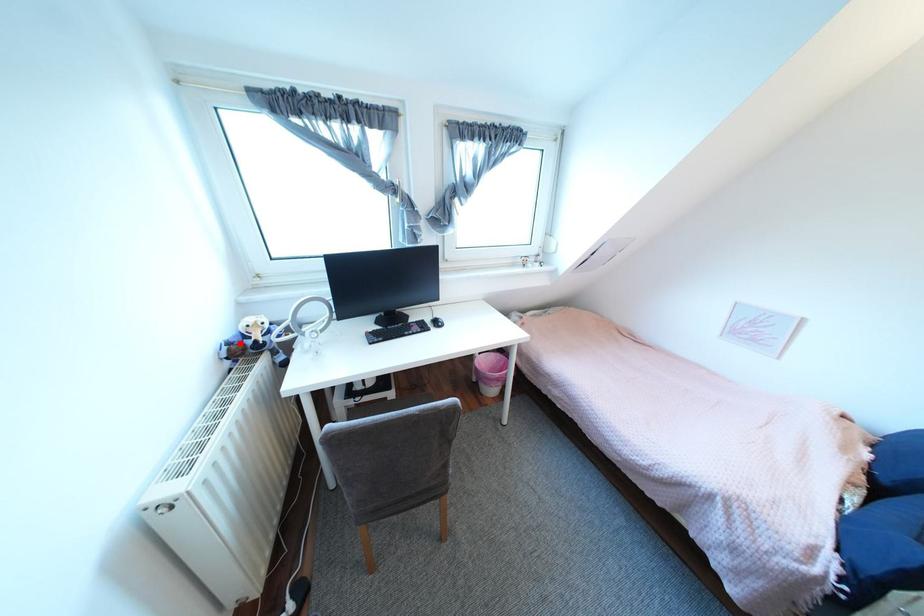
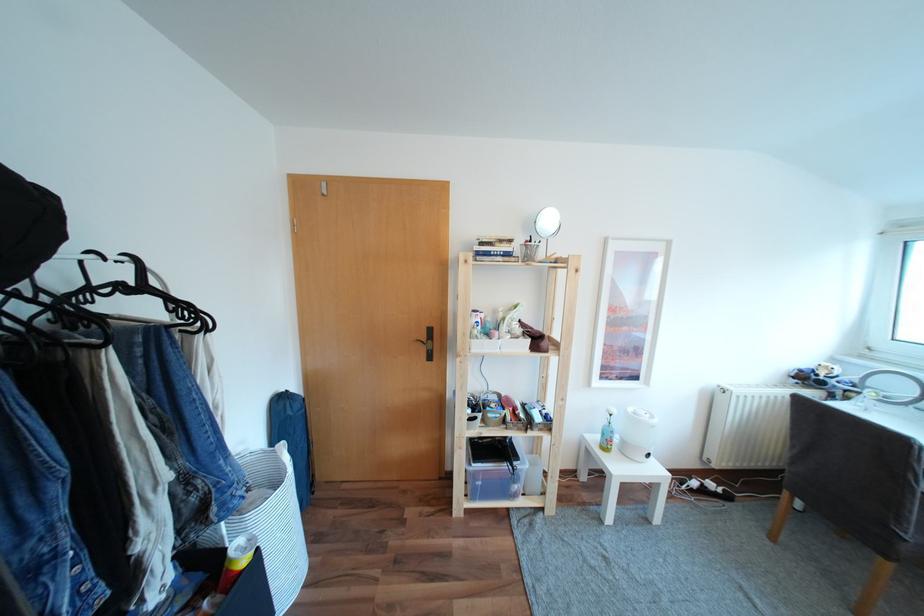
Question: I am providing you with two images of the same scene from different viewpoints. A red point is marked on the first image. Is the red point's position out of view in image 2?

Choices:
 (A) Yes
 (B) No

Answer: (B)